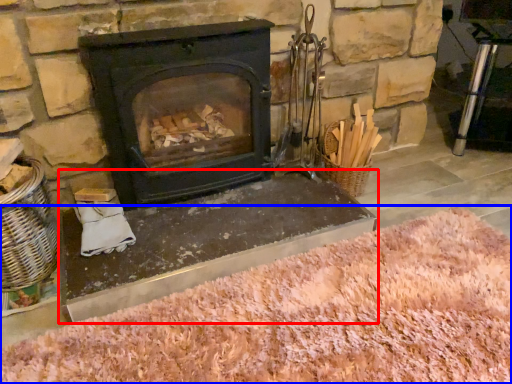
Question: Among these objects, which one is farthest to the camera, table (highlighted by a red box) or sand (highlighted by a blue box)?

Choices:
 (A) table
 (B) sand

Answer: (A)